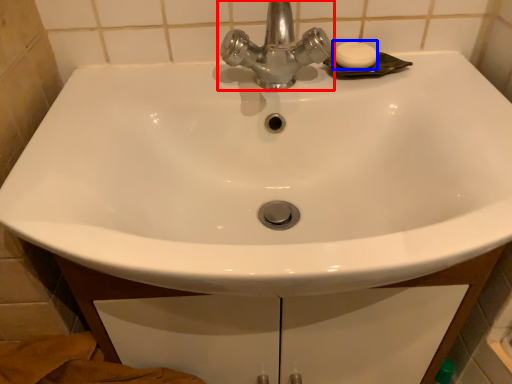
Question: Which object appears closest to the camera in this image, tap (highlighted by a red box) or soap (highlighted by a blue box)?

Choices:
 (A) tap
 (B) soap

Answer: (A)